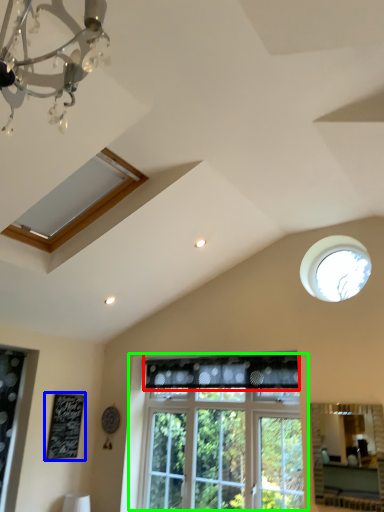
Question: Considering the real-world distances, which object is closest to curtain (highlighted by a red box)? bulletin board (highlighted by a blue box) or window (highlighted by a green box).

Choices:
 (A) bulletin board
 (B) window

Answer: (B)